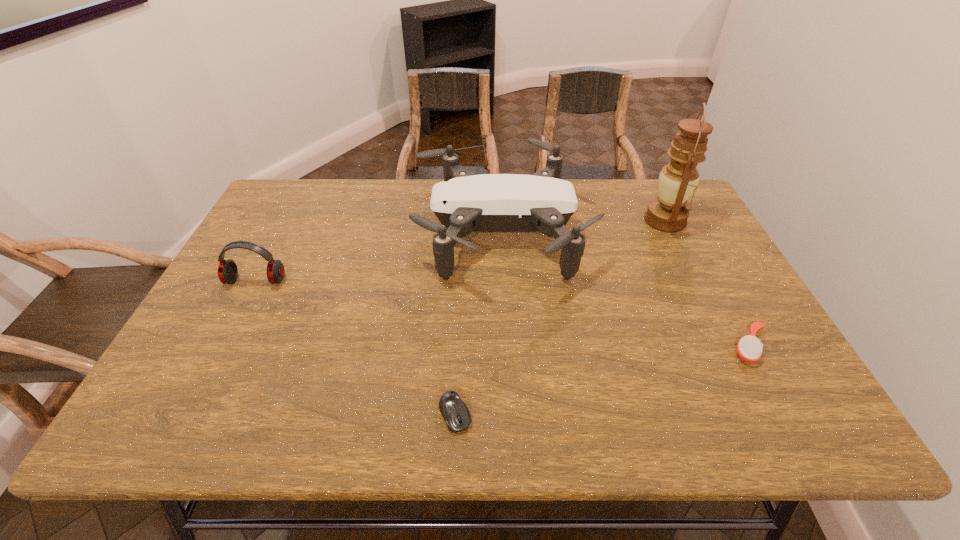
I want to click on vacant area situated on the ear cups of the leftmost object, so click(x=245, y=304).

Locate an element on the screen. The width and height of the screenshot is (960, 540). vacant region located on the back of the hairbrush is located at coordinates pyautogui.click(x=698, y=252).

Where is `vacant space located on the left of the nearest object`? The image size is (960, 540). vacant space located on the left of the nearest object is located at coordinates (345, 414).

The width and height of the screenshot is (960, 540). In order to click on oil lamp located at the far edge in this screenshot , I will do `click(678, 179)`.

Where is `drone positioned at the far edge`? drone positioned at the far edge is located at coordinates (464, 202).

I want to click on object positioned at the near edge, so click(x=456, y=414).

You are a GUI agent. You are given a task and a screenshot of the screen. Output one action in this format:
    pyautogui.click(x=<x>, y=<y>)
    Task: Click on the object located at the left edge
    This screenshot has width=960, height=540.
    Given the screenshot: What is the action you would take?
    pyautogui.click(x=227, y=271)

Locate an element on the screen. This screenshot has width=960, height=540. oil lamp that is at the right edge is located at coordinates (678, 179).

I want to click on hairbrush at the right edge, so click(x=749, y=348).

In order to click on object present at the far right corner in this screenshot , I will do `click(678, 179)`.